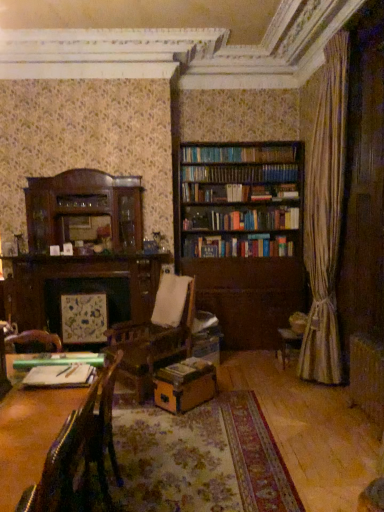
Question: Is green matte ruler at lower left, positioned as the first book in top-to-bottom order, in contact with leather-like dark brown chair at lower left, which is the 2th chair from front to back?

Choices:
 (A) yes
 (B) no

Answer: (B)

Question: Would you say green matte ruler at lower left, marked as the 1th book in a left-to-right arrangement, is outside leather-like dark brown chair at lower left, the first chair positioned from the back?

Choices:
 (A) yes
 (B) no

Answer: (B)

Question: Is green matte ruler at lower left, which is the second book in right-to-left order, aimed at leather-like dark brown chair at lower left, the first chair positioned from the back?

Choices:
 (A) no
 (B) yes

Answer: (B)

Question: Does green matte ruler at lower left, which is the second book in right-to-left order, have a lesser height compared to leather-like dark brown chair at lower left, which is the 2th chair from front to back?

Choices:
 (A) no
 (B) yes

Answer: (B)

Question: From a real-world perspective, is green matte ruler at lower left, positioned as the first book in top-to-bottom order, over leather-like dark brown chair at lower left, the first chair positioned from the back?

Choices:
 (A) no
 (B) yes

Answer: (B)

Question: Is green matte ruler at lower left, the first book from the front, smaller than leather-like dark brown chair at lower left, which is the 2th chair from front to back?

Choices:
 (A) yes
 (B) no

Answer: (A)

Question: Does wooden book at center, which is the second book from left to right, appear on the left side of leather cushioned chair at lower left, the second chair in the back-to-front sequence?

Choices:
 (A) yes
 (B) no

Answer: (B)

Question: From a real-world perspective, is wooden book at center, the 2th book when ordered from top to bottom, under leather cushioned chair at lower left, which ranks as the first chair in front-to-back order?

Choices:
 (A) yes
 (B) no

Answer: (A)

Question: Is wooden book at center, which is the first book in bottom-to-top order, bigger than leather cushioned chair at lower left, the second chair in the back-to-front sequence?

Choices:
 (A) no
 (B) yes

Answer: (A)

Question: Is wooden book at center, which ranks as the 2th book in front-to-back order, behind leather cushioned chair at lower left, the second chair in the back-to-front sequence?

Choices:
 (A) no
 (B) yes

Answer: (B)

Question: Is wooden book at center, which appears as the 1th book when viewed from the back, not close to leather cushioned chair at lower left, which ranks as the first chair in front-to-back order?

Choices:
 (A) no
 (B) yes

Answer: (B)

Question: Considering the relative sizes of wooden book at center, which ranks as the 2th book in front-to-back order, and leather cushioned chair at lower left, which ranks as the first chair in front-to-back order, in the image provided, is wooden book at center, which ranks as the 2th book in front-to-back order, smaller than leather cushioned chair at lower left, which ranks as the first chair in front-to-back order,?

Choices:
 (A) yes
 (B) no

Answer: (A)

Question: Does leather cushioned chair at lower left, which ranks as the first chair in front-to-back order, have a greater width compared to wooden book at center, which appears as the 1th book when viewed from the back?

Choices:
 (A) no
 (B) yes

Answer: (B)